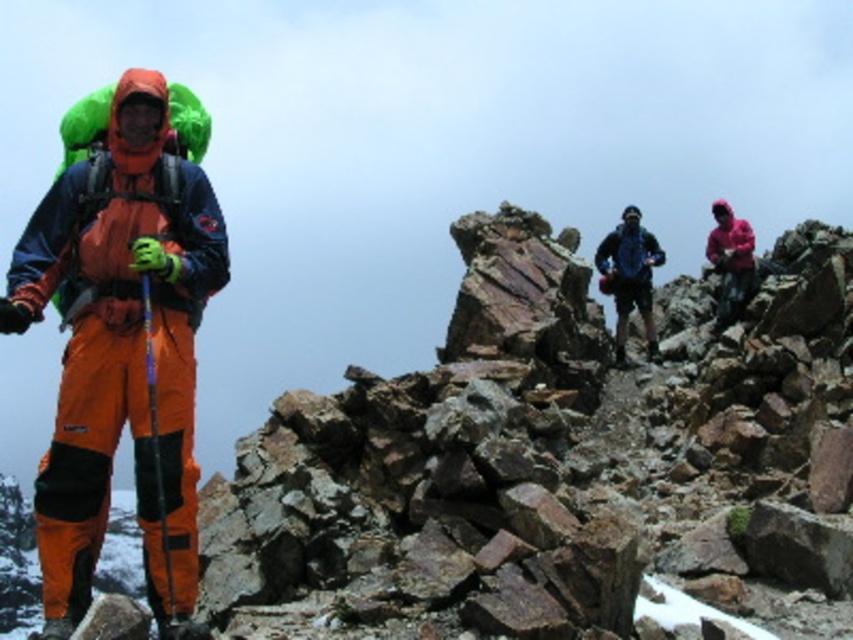
Question: Which point appears closest to the camera in this image?

Choices:
 (A) (456, 333)
 (B) (199, 168)

Answer: (B)

Question: Can you confirm if rugged stone mountain at center is smaller than orange softshell jacket at left?

Choices:
 (A) no
 (B) yes

Answer: (A)

Question: Can you confirm if rugged stone mountain at center is bigger than orange softshell jacket at left?

Choices:
 (A) no
 (B) yes

Answer: (B)

Question: Is the position of rugged stone mountain at center less distant than that of orange softshell jacket at left?

Choices:
 (A) yes
 (B) no

Answer: (B)

Question: Among these points, which one is farthest from the camera?

Choices:
 (A) (634, 580)
 (B) (97, 310)

Answer: (B)